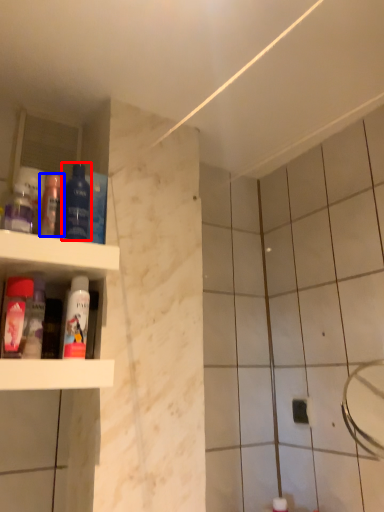
Question: Among these objects, which one is nearest to the camera, mouthwash (highlighted by a red box) or mouthwash (highlighted by a blue box)?

Choices:
 (A) mouthwash
 (B) mouthwash

Answer: (A)